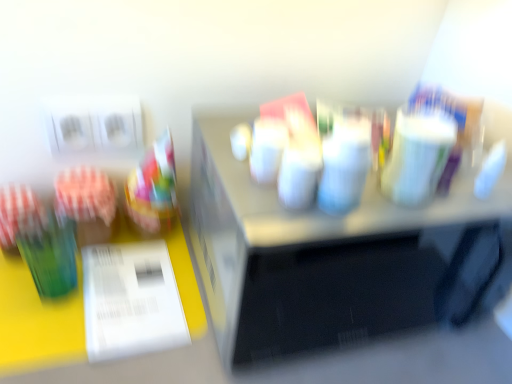
Question: Considering the positions of point (169, 340) and point (98, 231), is point (169, 340) closer or farther from the camera than point (98, 231)?

Choices:
 (A) farther
 (B) closer

Answer: (B)

Question: From a real-world perspective, is white glossy paper at lower left positioned above or below green glass at left?

Choices:
 (A) above
 (B) below

Answer: (B)

Question: Which object is positioned closest to the green glass at left?

Choices:
 (A) translucent plastic cup at left
 (B) metallic silver microwave at center
 (C) white glossy paper at lower left

Answer: (A)

Question: Estimate the real-world distances between objects in this image. Which object is farther from the translucent plastic cup at left?

Choices:
 (A) white glossy paper at lower left
 (B) metallic silver microwave at center
 (C) green glass at left

Answer: (B)